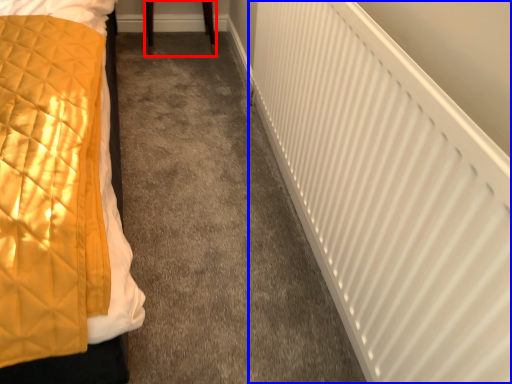
Question: Which point is closer to the camera, furniture (highlighted by a red box) or radiator (highlighted by a blue box)?

Choices:
 (A) furniture
 (B) radiator

Answer: (B)